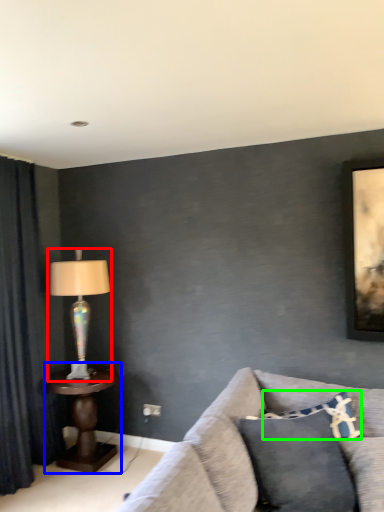
Question: Which is nearer to the lamp (highlighted by a red box)? table (highlighted by a blue box) or pillow (highlighted by a green box).

Choices:
 (A) table
 (B) pillow

Answer: (A)